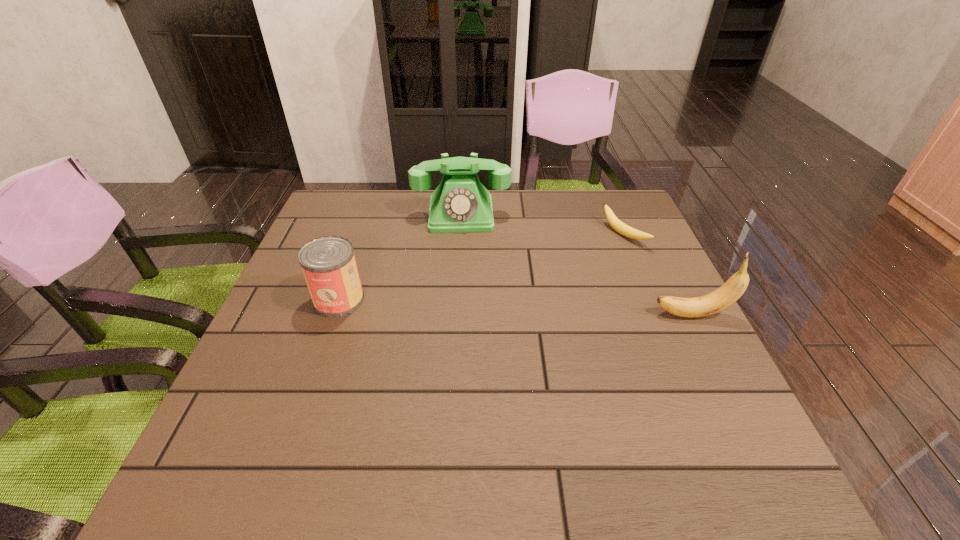
The image size is (960, 540). In order to click on the leftmost object in this screenshot , I will do `click(328, 263)`.

At what (x,y) coordinates should I click in order to perform the action: click on can. Please return your answer as a coordinate pair (x, y). Image resolution: width=960 pixels, height=540 pixels. Looking at the image, I should click on (328, 263).

This screenshot has height=540, width=960. I want to click on the taller banana, so click(735, 286).

Identify the location of the shorter banana. The height and width of the screenshot is (540, 960). (615, 223).

This screenshot has height=540, width=960. In order to click on the farther banana in this screenshot , I will do `click(615, 223)`.

Find the location of a particular element. The height and width of the screenshot is (540, 960). telephone is located at coordinates (460, 203).

This screenshot has width=960, height=540. I want to click on free space located 0.140m on the back of the second shortest object, so click(x=357, y=249).

Identify the location of free space located 0.350m at the start of the peel on the nearer banana. (499, 315).

Identify the location of free space located 0.210m at the start of the peel on the nearer banana. (561, 315).

Find the location of a particular element. The width and height of the screenshot is (960, 540). free location located 0.340m at the start of the peel on the nearer banana is located at coordinates (503, 315).